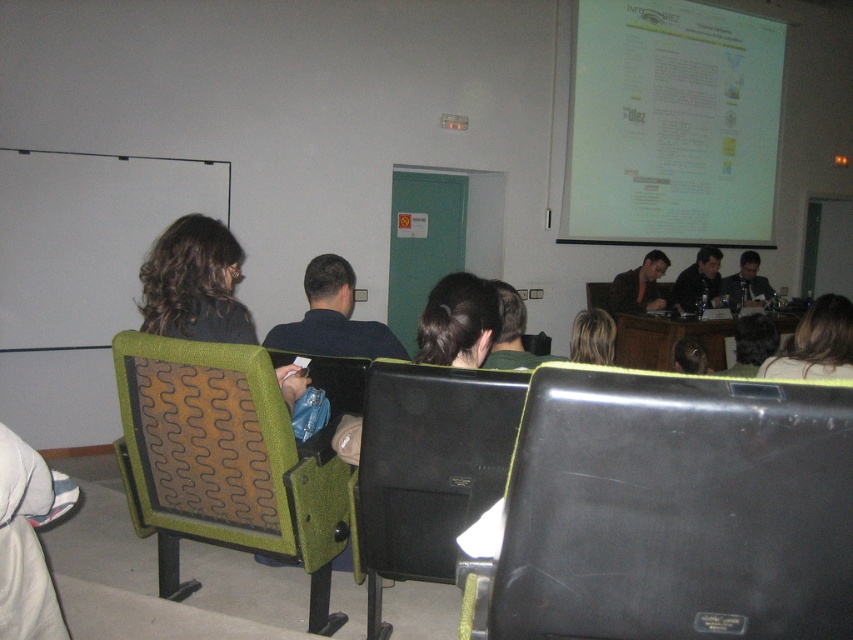
Question: Which is nearer to the green fabric chair at center?

Choices:
 (A) matte black laptop at center
 (B) dark blue shirt at center

Answer: (B)

Question: Is white paper at upper right to the right of dark brown leather jacket at center from the viewer's perspective?

Choices:
 (A) no
 (B) yes

Answer: (A)

Question: In this image, where is dark blue shirt at center located relative to dark suit jacket at right?

Choices:
 (A) right
 (B) left

Answer: (B)

Question: Among these objects, which one is farthest from the camera?

Choices:
 (A) dark brown leather jacket at center
 (B) white paper at upper right
 (C) green fabric chair at center

Answer: (A)

Question: Can you confirm if white paper at upper right is thinner than dark suit jacket at right?

Choices:
 (A) yes
 (B) no

Answer: (B)

Question: Among these objects, which one is nearest to the camera?

Choices:
 (A) black leather chair at lower right
 (B) matte black laptop at center
 (C) dark brown leather jacket at center

Answer: (A)